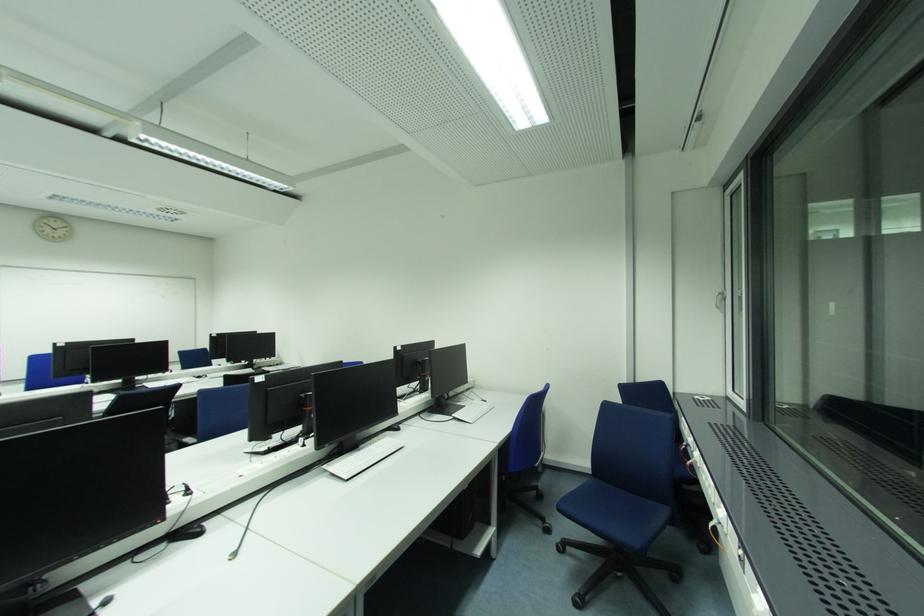
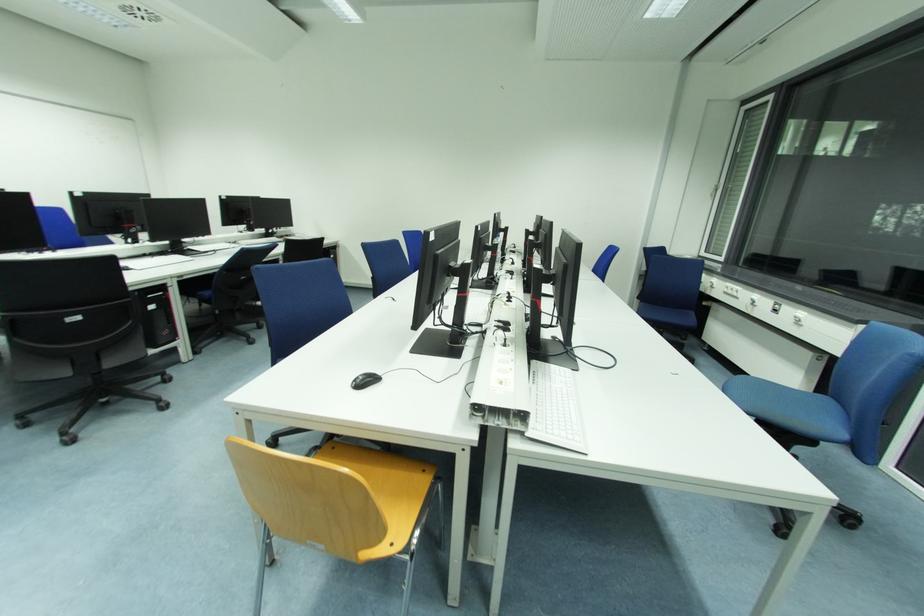
Question: Which direction would the cameraman need to move to produce the second image? Reply with the corresponding letter.

Choices:
 (A) Left
 (B) Right
 (C) Forward
 (D) Backward

Answer: (A)